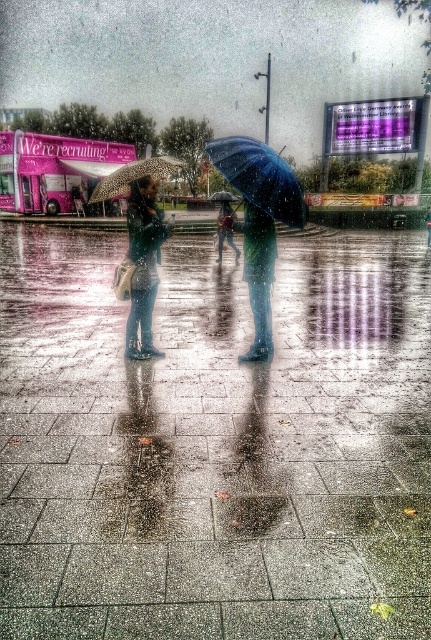
Which of these two, matte pink bus at left or shiny blue umbrella at center, stands shorter?

Standing shorter between the two is matte pink bus at left.

Which is in front, point (34, 144) or point (261, 179)?

Point (261, 179) is in front.

This screenshot has width=431, height=640. I want to click on matte pink bus at left, so click(x=53, y=170).

Who is more distant from viewer, (212, 614) or (147, 323)?

The point (147, 323) is more distant.

Who is taller, shiny concrete pavement at center or matte blue jacket at center?

shiny concrete pavement at center is taller.

What do you see at coordinates (215, 444) in the screenshot?
I see `shiny concrete pavement at center` at bounding box center [215, 444].

Identify the location of shiny concrete pavement at center. (215, 444).

Does matte pink bus at left have a smaller size compared to matte blue jacket at center?

Incorrect, matte pink bus at left is not smaller in size than matte blue jacket at center.

Can you confirm if matte pink bus at left is shorter than matte blue jacket at center?

No, matte pink bus at left is not shorter than matte blue jacket at center.

Is point (55, 180) closer to viewer compared to point (141, 348)?

That is False.

Find the location of a particular element. matte pink bus at left is located at coordinates (53, 170).